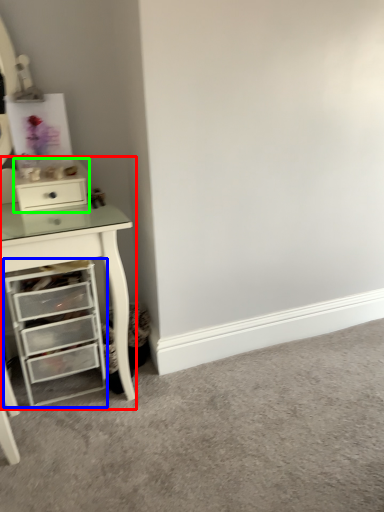
Question: Which object is positioned farthest from computer desk (highlighted by a red box)? Select from chest of drawers (highlighted by a blue box) and file cabinet (highlighted by a green box).

Choices:
 (A) chest of drawers
 (B) file cabinet

Answer: (B)